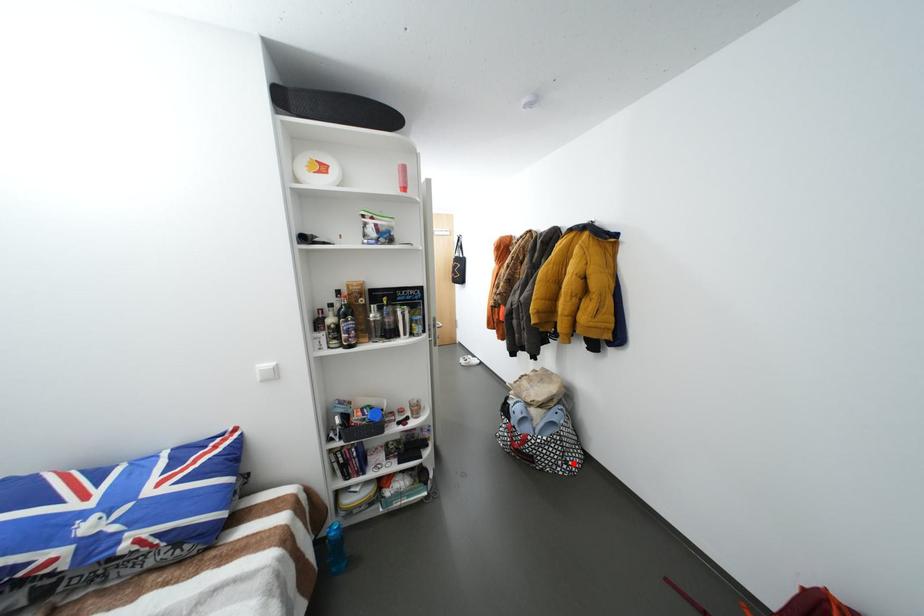
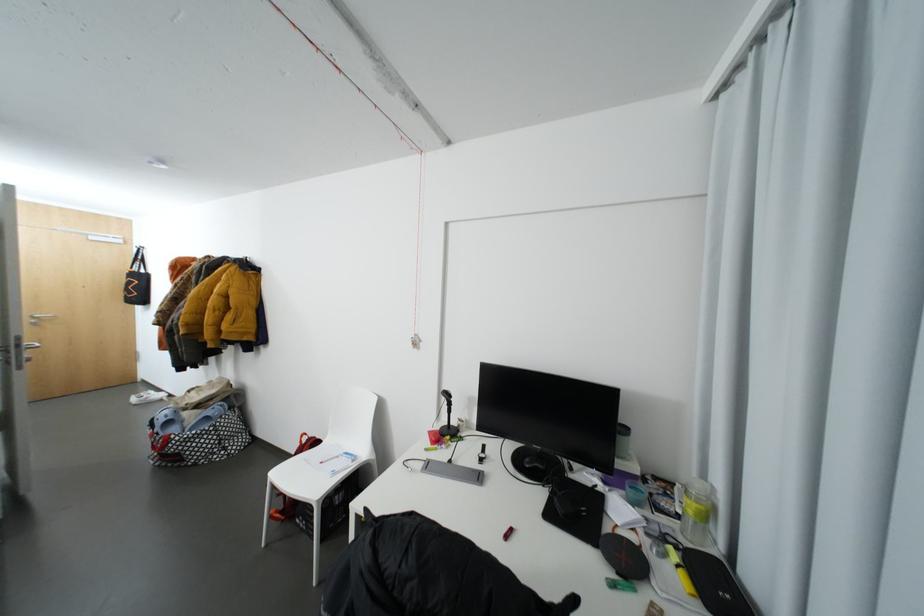
In the second image, find the point that corresponds to the highlighted location in the first image.

(232, 448)